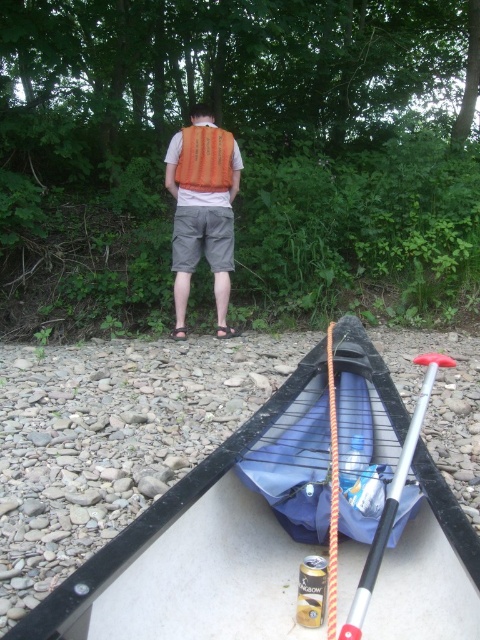
You are standing at the point marked as point [184,257] by a small red flag. You want to take a photo of the canoe and the person in the orange life vest from where you are. How far will you have to move to get both the canoe and the person in the frame?

The point marked as point [184,257] is 9.63 feet away from the camera. To capture both the canoe and the person in the orange life vest in the frame, you would need to stay at that point since both subjects are within the camera range.

You are navigating a small boat on the river and need to drop an anchor at two specific points marked as point (192, 198) and point (397, 465). Which point should you reach first if you want to follow the river current that flows from the upper left to the lower right direction?

You should reach point (397, 465) first because the river current flows from upper left to lower right, so this point is downstream of point (192, 198). Since point (192, 198) is behind point (397, 465), it is upstream and you would encounter point (397, 465) first while moving with the current.

You are a hiker who wants to cross the river using the black plastic boat at lower center. You see the silver metallic paddle at lower right nearby. Which object is closer to you, the boat or the paddle?

The black plastic boat at lower center is closer to you since it is further to the viewer than the silver metallic paddle at lower right.